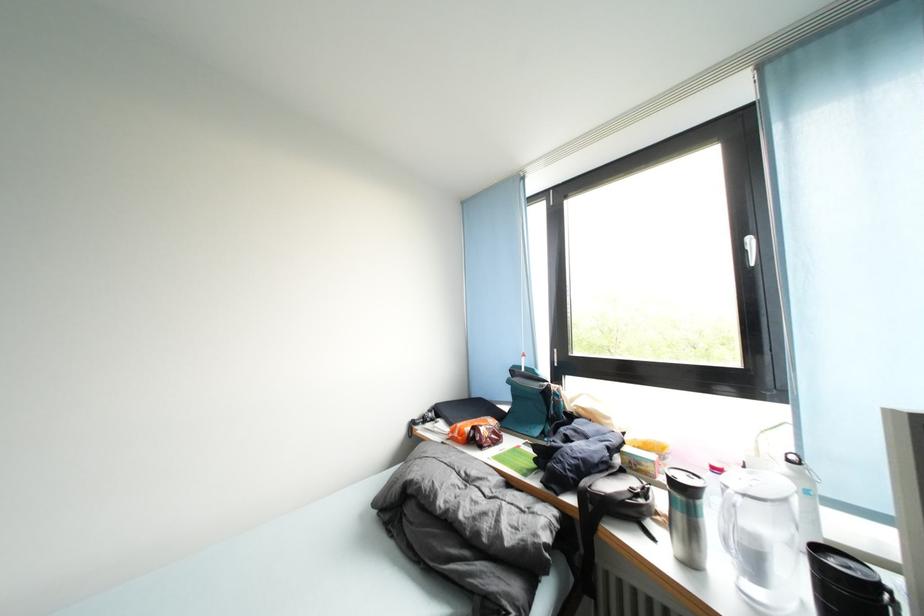
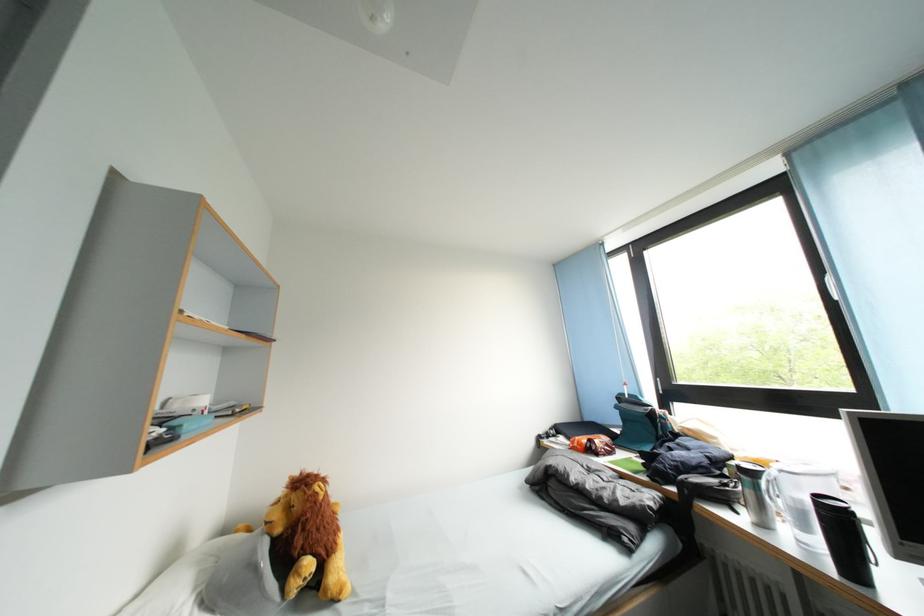
In the second image, find the point that corresponds to point (493, 532) in the first image.

(614, 501)